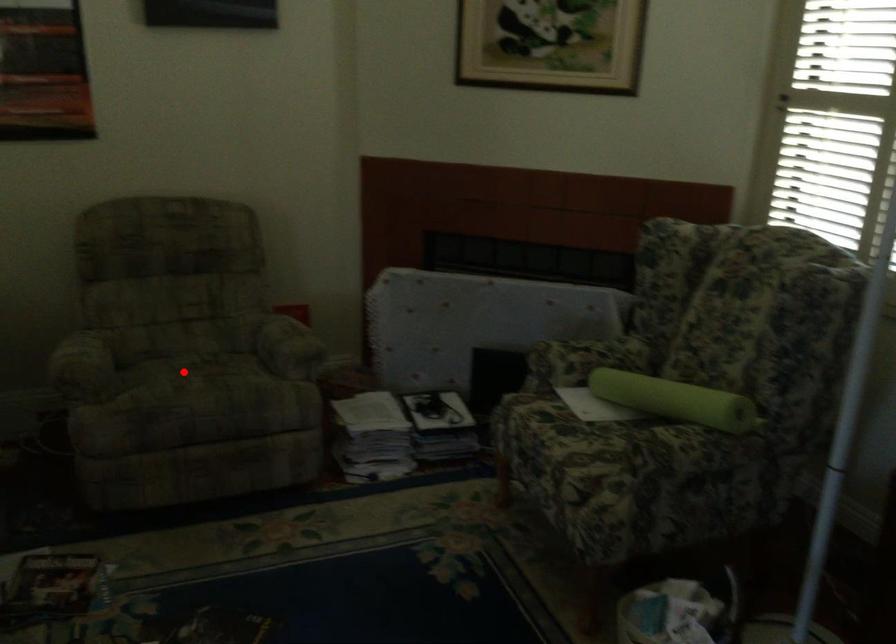
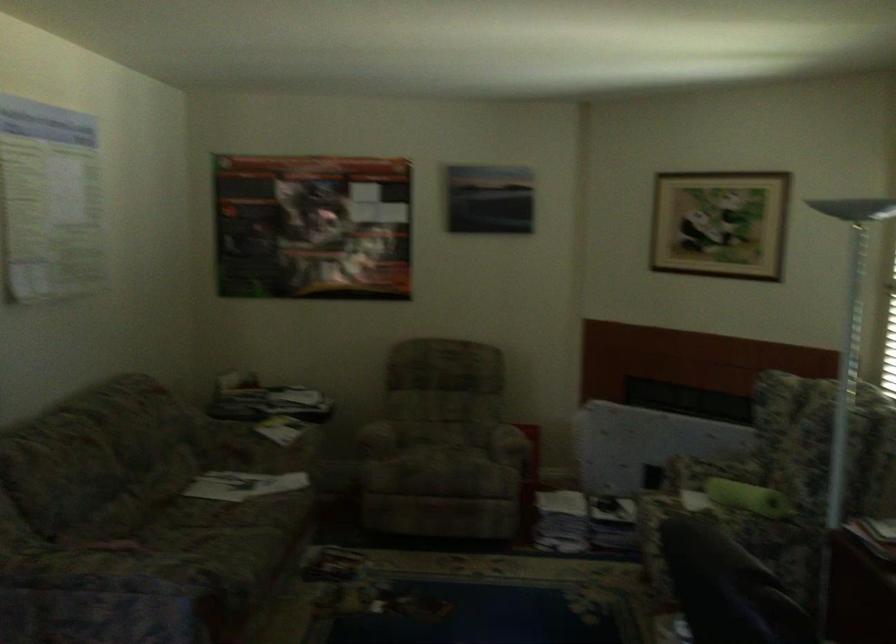
Find the pixel in the second image that matches the highlighted location in the first image.

(436, 451)